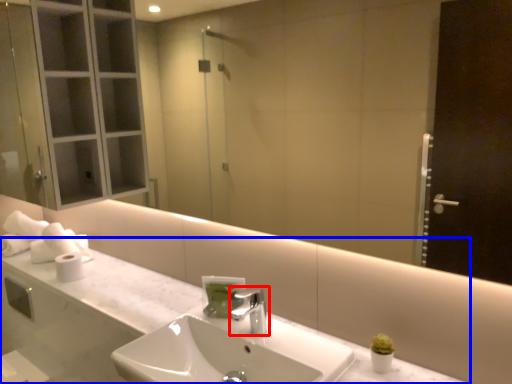
Question: Which point is further to the camera, tap (highlighted by a red box) or counter top (highlighted by a blue box)?

Choices:
 (A) tap
 (B) counter top

Answer: (A)